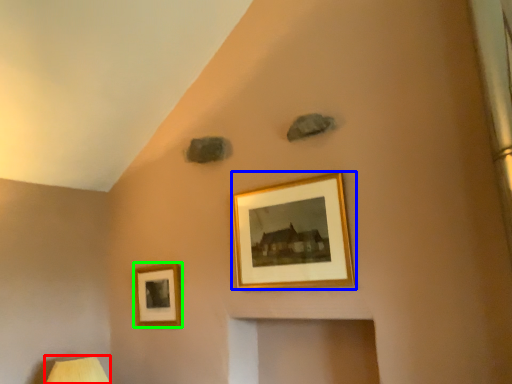
Question: Considering the real-world distances, which object is closest to table lamp (highlighted by a red box)? picture frame (highlighted by a blue box) or picture frame (highlighted by a green box).

Choices:
 (A) picture frame
 (B) picture frame

Answer: (B)